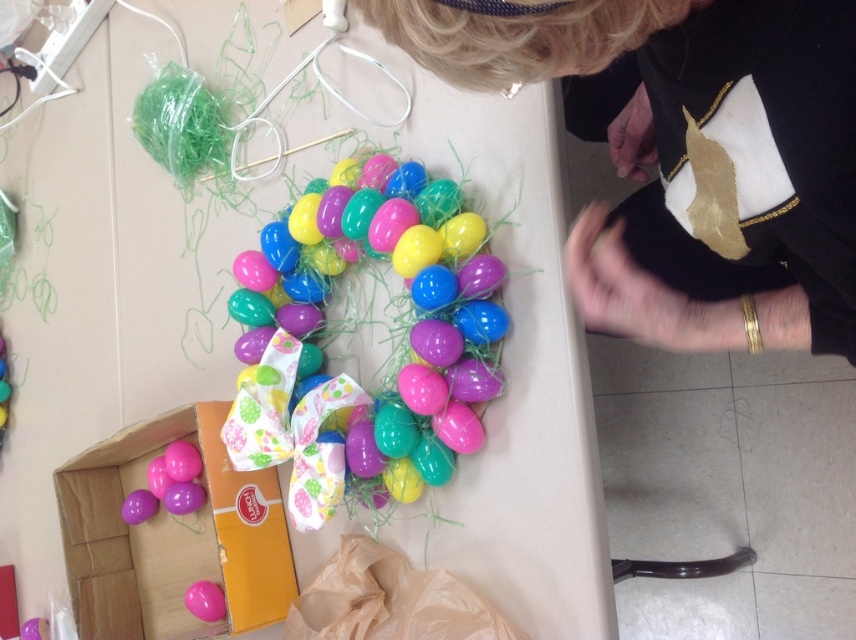
Question: Which of these objects is positioned closest to the shiny plastic eggs at center?

Choices:
 (A) matte plastic table at center
 (B) matte pink eggs at lower left
 (C) pink glossy balloon at lower left
 (D) black fabric at upper center

Answer: (A)

Question: Does matte plastic table at center have a larger size compared to black fabric at upper center?

Choices:
 (A) no
 (B) yes

Answer: (B)

Question: Estimate the real-world distances between objects in this image. Which object is closer to the shiny plastic eggs at center?

Choices:
 (A) pink glossy balloon at lower left
 (B) matte plastic table at center
 (C) black fabric at upper center

Answer: (B)

Question: Does matte plastic table at center lie behind black fabric at upper center?

Choices:
 (A) yes
 (B) no

Answer: (A)

Question: Which of the following is the farthest from the observer?

Choices:
 (A) (194, 589)
 (B) (803, 196)

Answer: (A)

Question: From the image, what is the correct spatial relationship of matte plastic table at center in relation to black fabric at upper center?

Choices:
 (A) below
 (B) above

Answer: (A)